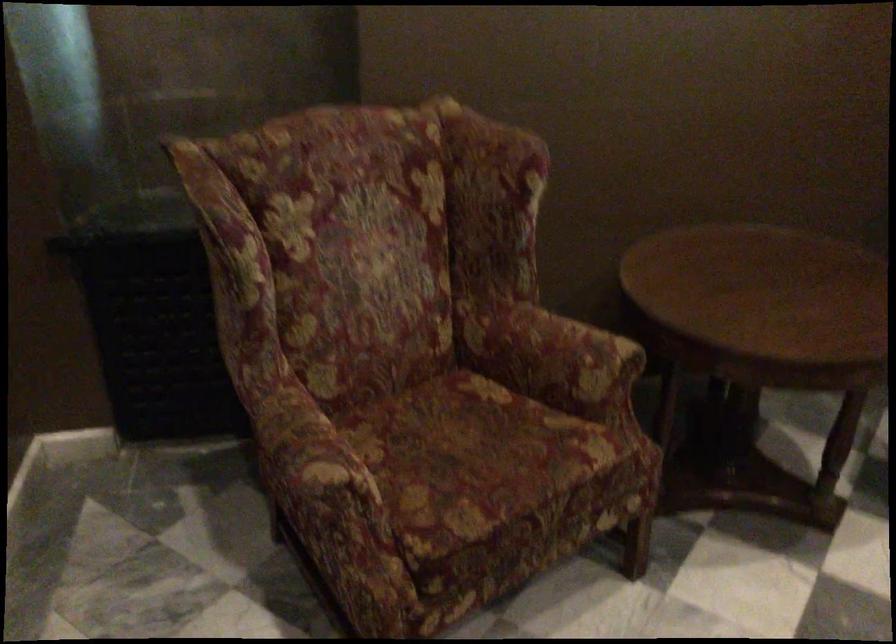
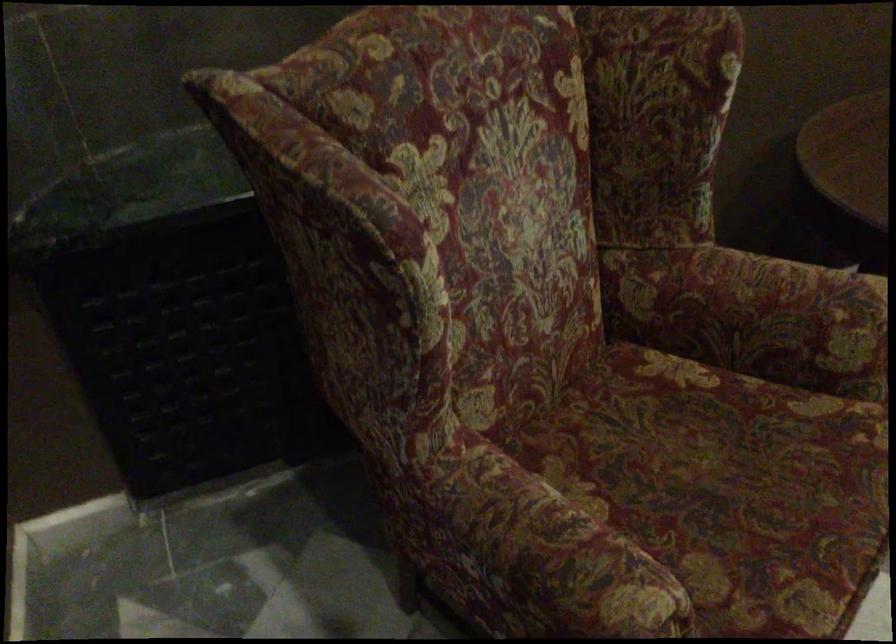
Locate, in the second image, the point that corresponds to point 467,453 in the first image.

(726, 486)